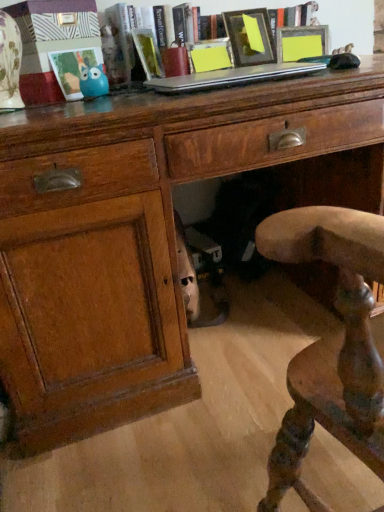
Question: Looking at the image, does hardcover book at upper center, positioned as the first book in right-to-left order, seem bigger or smaller compared to matte yellow picture frame at center, which is the second picture frame from left to right?

Choices:
 (A) big
 (B) small

Answer: (A)

Question: In terms of width, does hardcover book at upper center, positioned as the first book in right-to-left order, look wider or thinner when compared to matte yellow picture frame at center, the second picture frame in the right-to-left sequence?

Choices:
 (A) thin
 (B) wide

Answer: (B)

Question: Based on their relative distances, which object is nearer to the matte plastic picture frame at upper left, the 3th picture frame from the right?

Choices:
 (A) silver metallic laptop at upper center
 (B) matte yellow picture frame at center, which is the second picture frame from left to right
 (C) hardcover book at center, positioned as the 2th book in right-to-left order
 (D) hardcover book at upper center, positioned as the first book in right-to-left order
 (E) matte black picture frame at upper center, acting as the first picture frame starting from the right

Answer: (C)

Question: Considering the real-world distances, which object is closest to the silver metallic laptop at upper center?

Choices:
 (A) matte black picture frame at upper center, which appears as the third picture frame when viewed from the left
 (B) blue rubber toy at upper left
 (C) hardcover book at center, positioned as the 2th book in right-to-left order
 (D) matte yellow picture frame at center, the second picture frame in the right-to-left sequence
 (E) hardcover book at upper center, positioned as the first book in right-to-left order

Answer: (E)